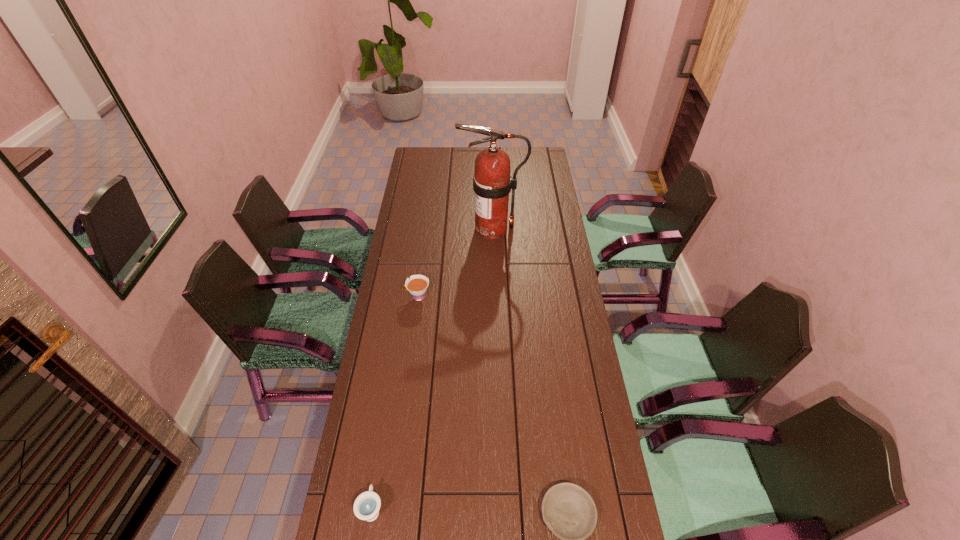
Locate an element on the screen. free space located on the side of the shorter teacup with the handle is located at coordinates (382, 442).

The height and width of the screenshot is (540, 960). I want to click on free space located on the side of the shorter teacup with the handle, so [x=393, y=377].

Where is `free space located on the side of the shorter teacup with the handle`? This screenshot has height=540, width=960. free space located on the side of the shorter teacup with the handle is located at coordinates (379, 462).

The width and height of the screenshot is (960, 540). In the image, there is a desktop. What are the coordinates of `free space at the far edge` in the screenshot? It's located at [x=468, y=153].

The width and height of the screenshot is (960, 540). Identify the location of free spot at the left edge of the desktop. (385, 331).

Find the location of a particular element. Image resolution: width=960 pixels, height=540 pixels. vacant space at the right edge of the desktop is located at coordinates (530, 189).

Where is `free spot between the farthest object and the second farthest object`? free spot between the farthest object and the second farthest object is located at coordinates (455, 262).

This screenshot has width=960, height=540. I want to click on free area in between the third nearest object and the third tallest object, so click(x=395, y=403).

Locate an element on the screen. The width and height of the screenshot is (960, 540). empty location between the farthest object and the taller teacup is located at coordinates (455, 262).

Identify the location of vacant space that's between the farther teacup and the fire extinguisher. The height and width of the screenshot is (540, 960). (455, 262).